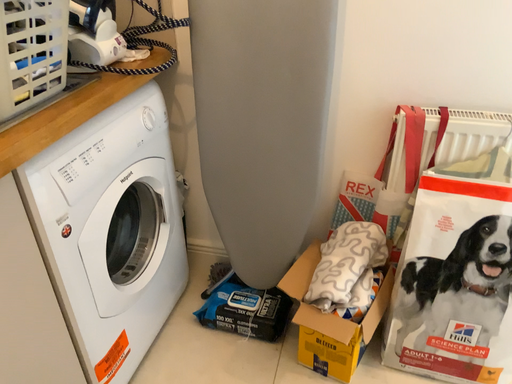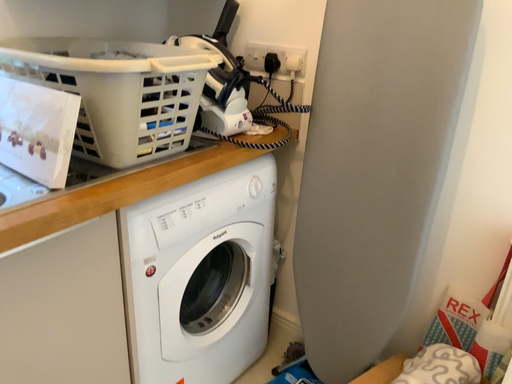
Question: Which way did the camera rotate in the video?

Choices:
 (A) rotated upward
 (B) rotated downward

Answer: (A)